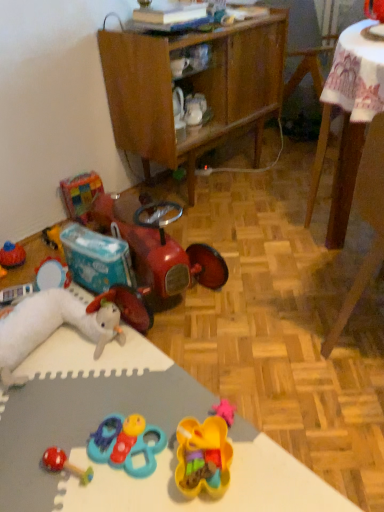
Identify the location of free area below wooden cabinet at upper center (from a real-world perspective). (206, 184).